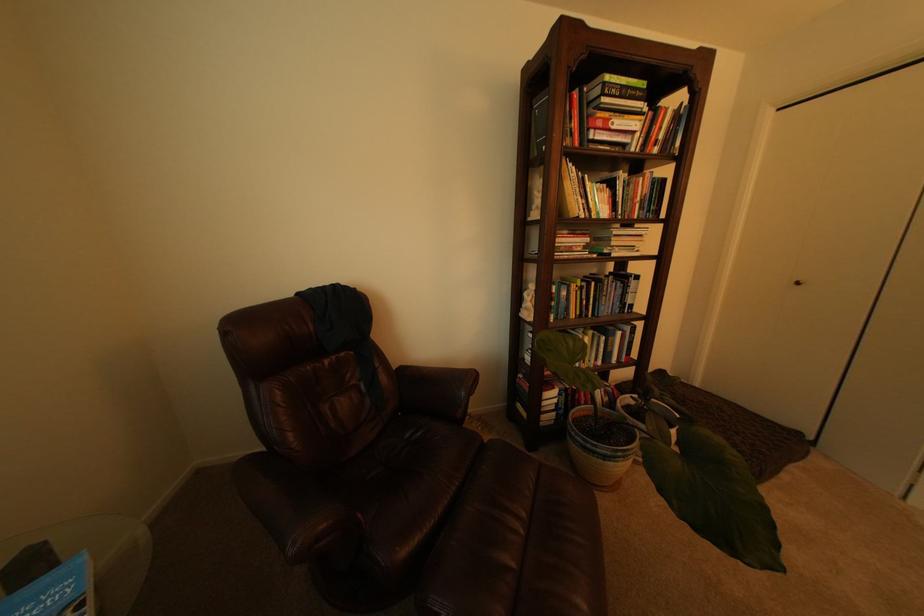
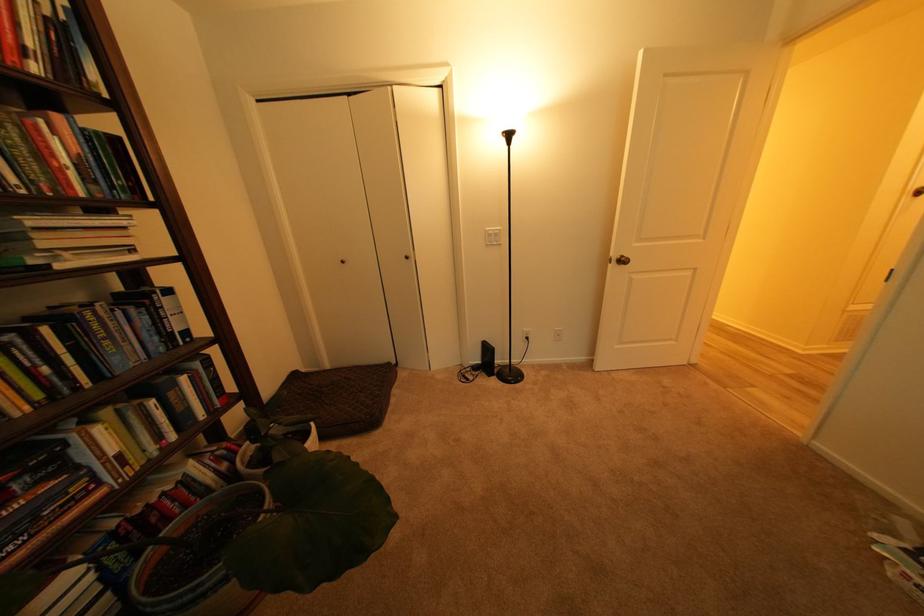
Find the pixel in the second image that matches point 654,196 in the first image.

(84, 156)